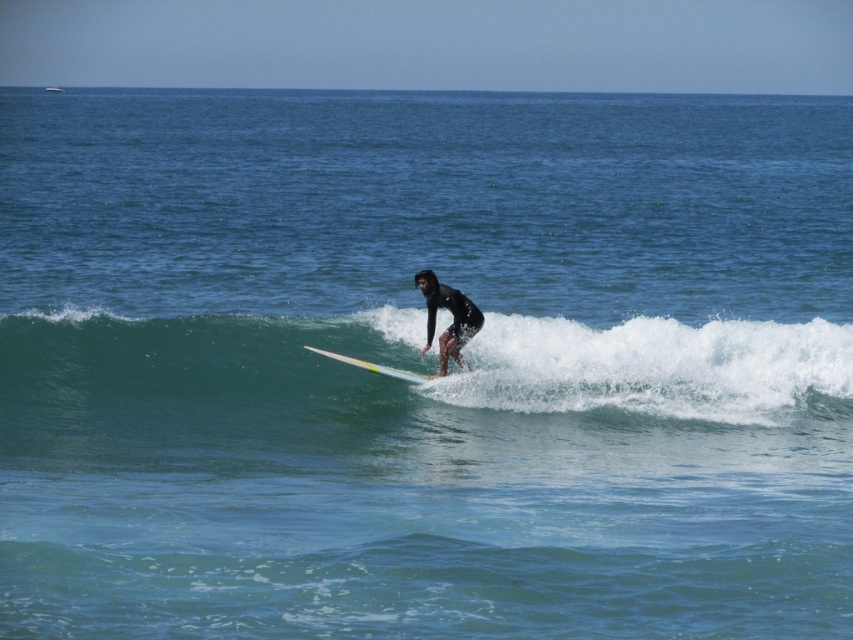
Question: Which is farther from the green rubber wave at center?

Choices:
 (A) black wetsuit surfer at center
 (B) yellow glossy surfboard at center

Answer: (B)

Question: Which is nearer to the yellow glossy surfboard at center?

Choices:
 (A) black wetsuit surfer at center
 (B) green rubber wave at center

Answer: (A)

Question: From the image, what is the correct spatial relationship of black wetsuit surfer at center in relation to yellow glossy surfboard at center?

Choices:
 (A) above
 (B) below

Answer: (A)

Question: Can you confirm if green rubber wave at center is thinner than yellow glossy surfboard at center?

Choices:
 (A) no
 (B) yes

Answer: (A)

Question: Is black wetsuit surfer at center above yellow glossy surfboard at center?

Choices:
 (A) yes
 (B) no

Answer: (A)

Question: Among these points, which one is nearest to the camera?

Choices:
 (A) click(x=502, y=376)
 (B) click(x=421, y=376)

Answer: (A)